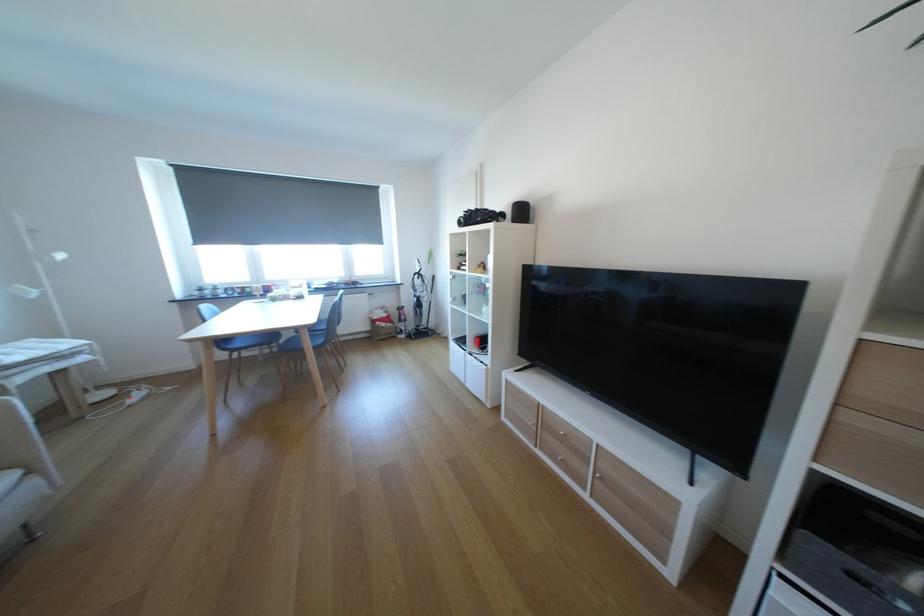
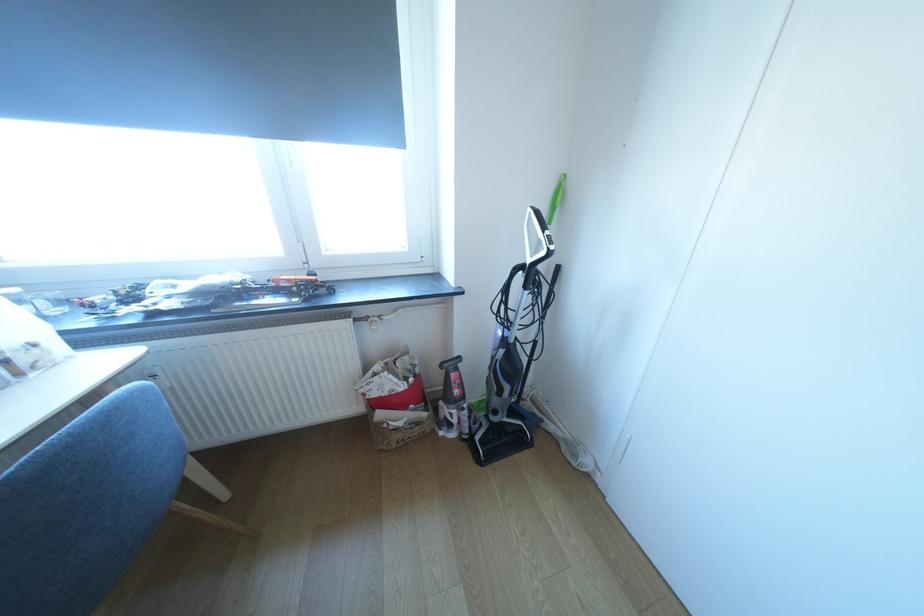
Question: What movement of the cameraman would produce the second image?

Choices:
 (A) Left
 (B) Right
 (C) Forward
 (D) Backward

Answer: (C)